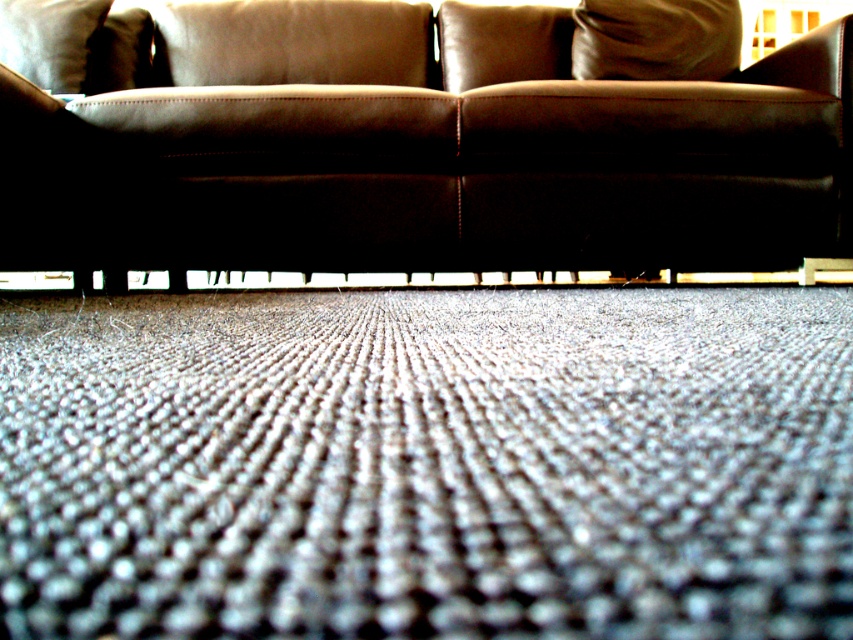
Question: Can you confirm if gray textured mat at lower center is thinner than leather couch at center?

Choices:
 (A) no
 (B) yes

Answer: (B)

Question: Which point is closer to the camera?

Choices:
 (A) (160, 150)
 (B) (805, 461)

Answer: (B)

Question: Can you confirm if gray textured mat at lower center is positioned below leather couch at center?

Choices:
 (A) no
 (B) yes

Answer: (B)

Question: Which point appears closest to the camera in this image?

Choices:
 (A) pyautogui.click(x=492, y=67)
 (B) pyautogui.click(x=776, y=582)

Answer: (B)

Question: Which point appears farthest from the camera in this image?

Choices:
 (A) (657, 454)
 (B) (416, 134)

Answer: (B)

Question: In this image, where is gray textured mat at lower center located relative to leather couch at center?

Choices:
 (A) left
 (B) right

Answer: (B)